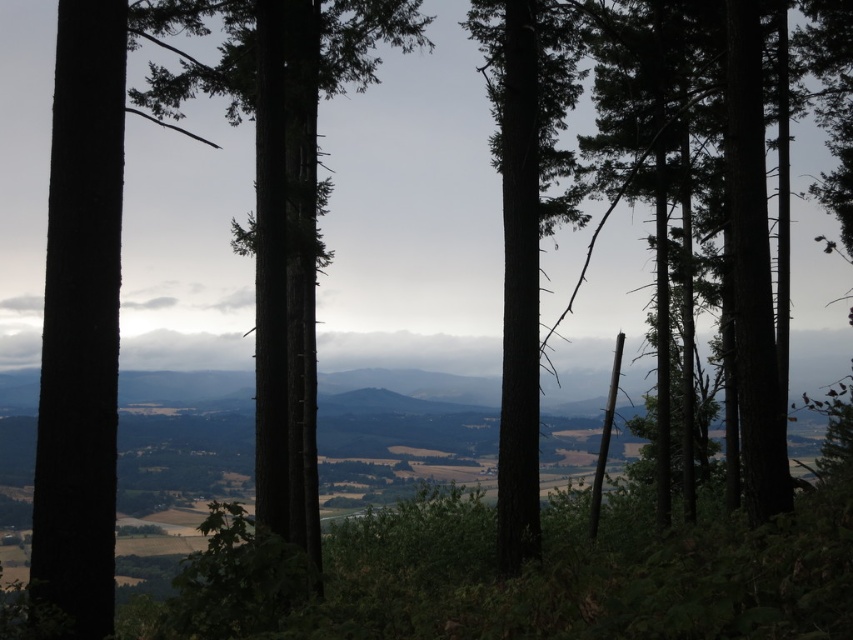
Question: Does dark green bark tree at center have a lesser width compared to smooth bark tree at center?

Choices:
 (A) no
 (B) yes

Answer: (A)

Question: Does dark green bark tree at center have a greater width compared to smooth bark tree at center?

Choices:
 (A) no
 (B) yes

Answer: (B)

Question: Does dark green bark tree at center have a lesser width compared to smooth bark tree at center?

Choices:
 (A) yes
 (B) no

Answer: (B)